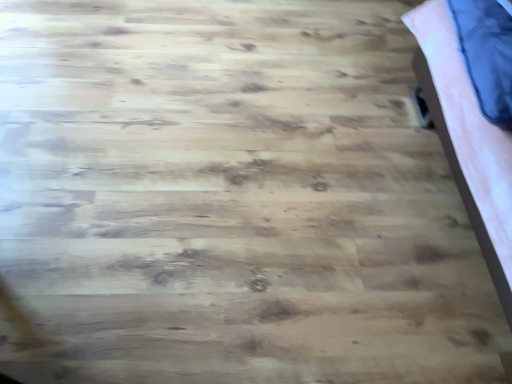
Question: From a real-world perspective, is velvety blue pillow at upper right above or below pink fabric bed at right?

Choices:
 (A) below
 (B) above

Answer: (B)

Question: Visually, is velvety blue pillow at upper right positioned to the left or to the right of pink fabric bed at right?

Choices:
 (A) right
 (B) left

Answer: (B)

Question: Considering the positions of velvety blue pillow at upper right and pink fabric bed at right in the image, is velvety blue pillow at upper right taller or shorter than pink fabric bed at right?

Choices:
 (A) tall
 (B) short

Answer: (B)

Question: Would you say pink fabric bed at right is inside or outside velvety blue pillow at upper right?

Choices:
 (A) inside
 (B) outside

Answer: (B)

Question: Is pink fabric bed at right taller or shorter than velvety blue pillow at upper right?

Choices:
 (A) short
 (B) tall

Answer: (B)

Question: In the image, is pink fabric bed at right on the left side or the right side of velvety blue pillow at upper right?

Choices:
 (A) left
 (B) right

Answer: (B)

Question: From the image's perspective, is pink fabric bed at right located above or below velvety blue pillow at upper right?

Choices:
 (A) above
 (B) below

Answer: (B)